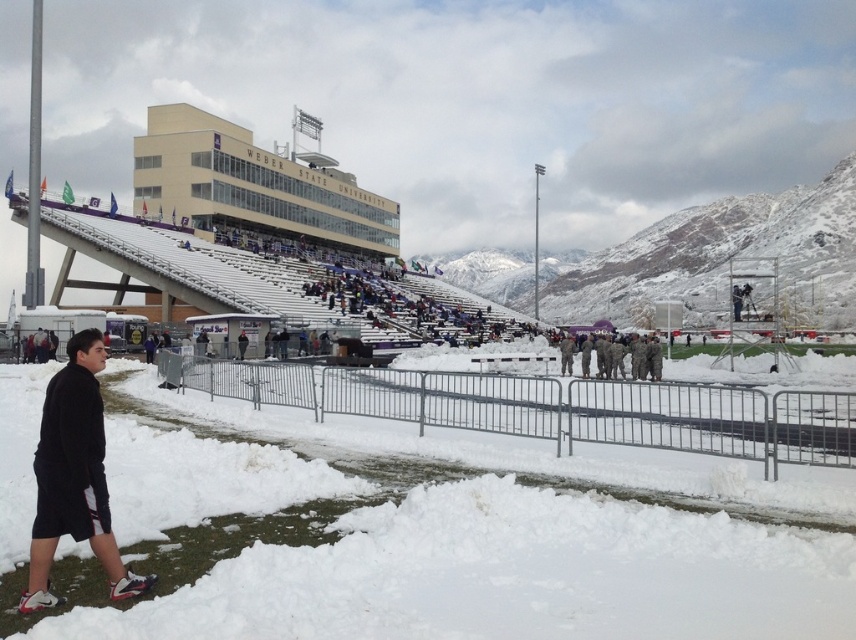
Is black matte shorts at lower left smaller than camouflage fabric soldiers at center?

No, black matte shorts at lower left is not smaller than camouflage fabric soldiers at center.

Can you confirm if black matte shorts at lower left is thinner than camouflage fabric soldiers at center?

No.

What do you see at coordinates (74, 476) in the screenshot? I see `black matte shorts at lower left` at bounding box center [74, 476].

At what (x,y) coordinates should I click in order to perform the action: click on black matte shorts at lower left. Please return your answer as a coordinate pair (x, y). Image resolution: width=856 pixels, height=640 pixels. Looking at the image, I should click on (74, 476).

Does white fluffy snow at lower left have a smaller size compared to camouflage fabric soldiers at center?

No.

Does white fluffy snow at lower left have a greater width compared to camouflage fabric soldiers at center?

Indeed, white fluffy snow at lower left has a greater width compared to camouflage fabric soldiers at center.

Describe the element at coordinates (508, 576) in the screenshot. I see `white fluffy snow at lower left` at that location.

The width and height of the screenshot is (856, 640). Identify the location of white fluffy snow at lower left. (508, 576).

Does matte beige building at upper center appear on the left side of camouflage fabric soldiers at center?

Yes, matte beige building at upper center is to the left of camouflage fabric soldiers at center.

Measure the distance between matte beige building at upper center and camouflage fabric soldiers at center.

57.37 meters

Between point (224, 132) and point (611, 368), which one is positioned in front?

Point (611, 368) is more forward.

This screenshot has height=640, width=856. What are the coordinates of `matte beige building at upper center` in the screenshot? It's located at (253, 186).